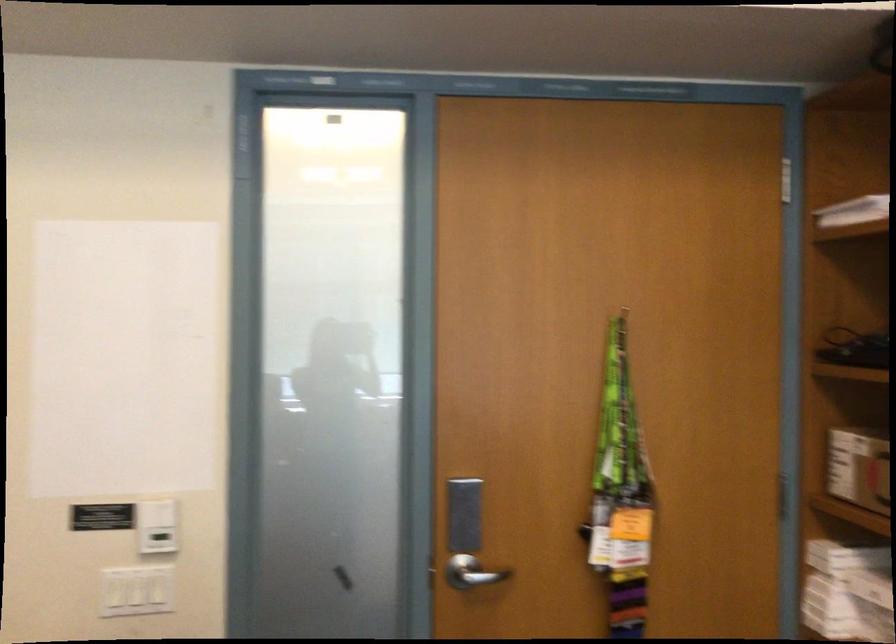
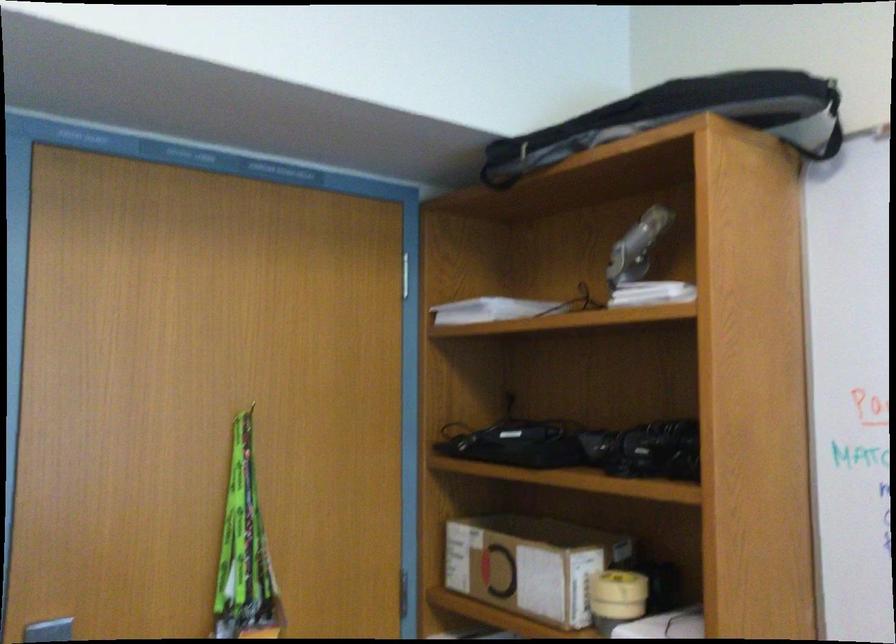
Question: The images are taken continuously from a first-person perspective. In which direction is your viewpoint rotating?

Choices:
 (A) Left
 (B) Right
 (C) Up
 (D) Down

Answer: (B)